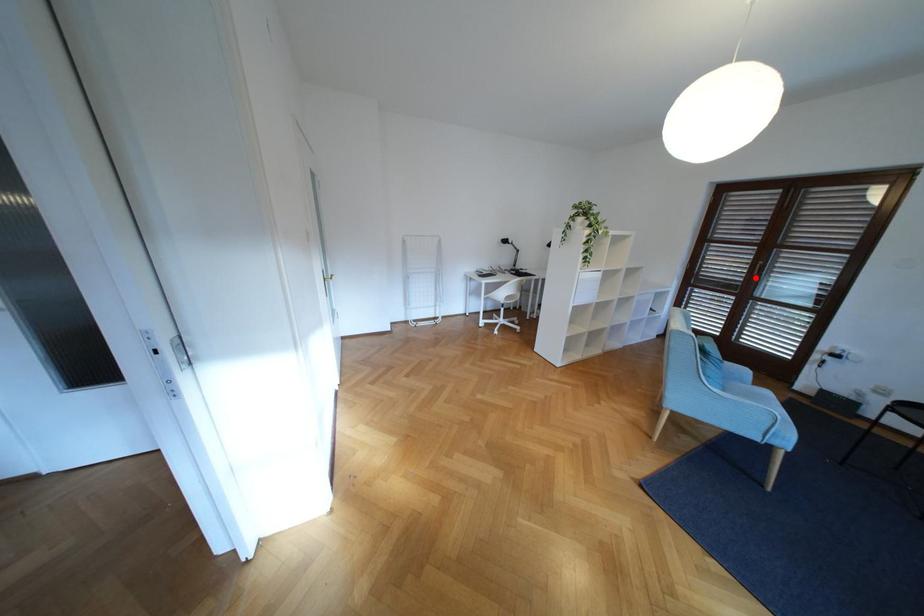
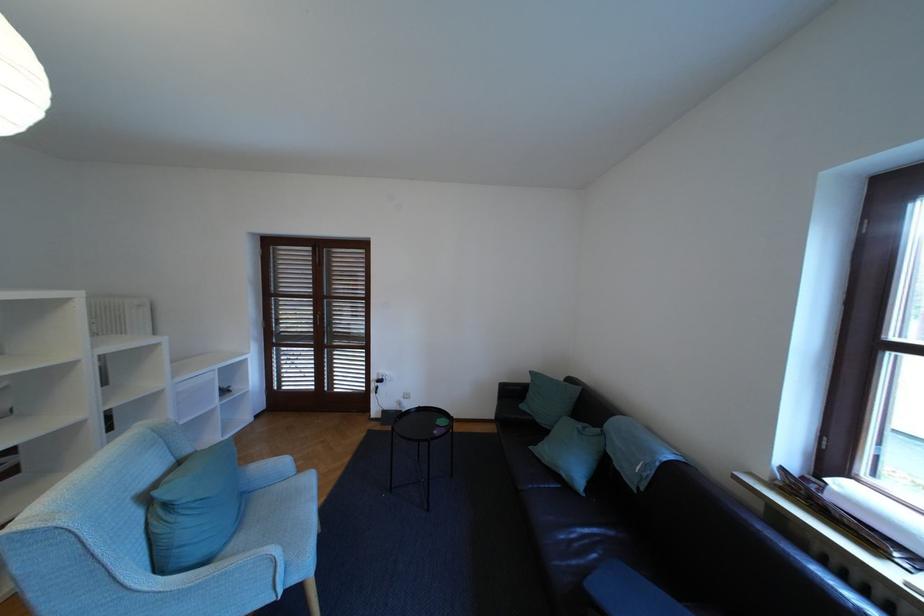
Find the pixel in the second image that matches the highlighted location in the first image.

(323, 328)